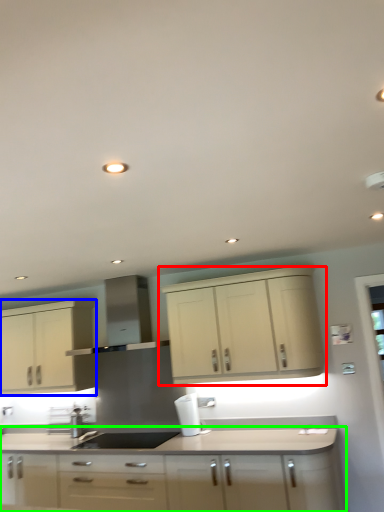
Question: Which object is positioned farthest from cabinetry (highlighted by a red box)? Select from cabinetry (highlighted by a blue box) and cabinetry (highlighted by a green box).

Choices:
 (A) cabinetry
 (B) cabinetry

Answer: (A)